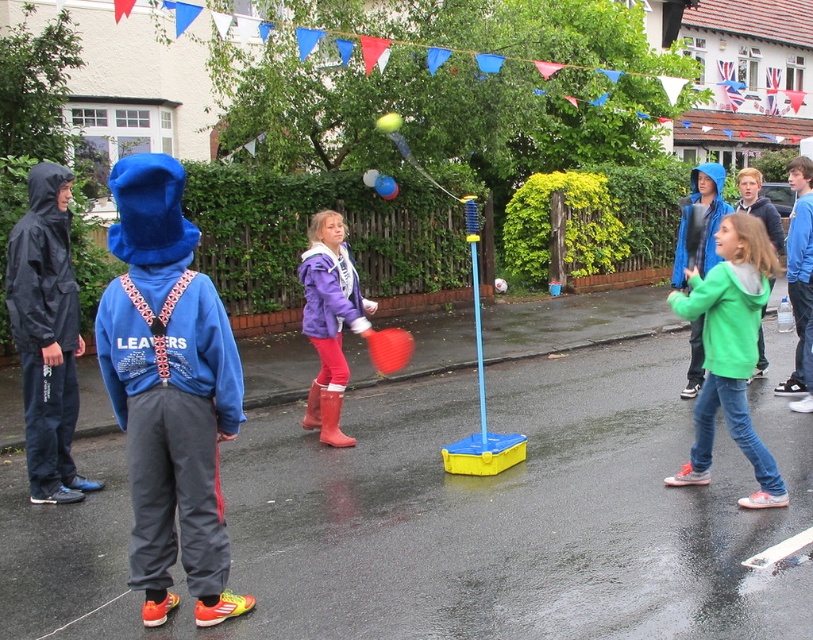
Question: Can you confirm if green fleece jacket at right is smaller than purple fleece jacket at center?

Choices:
 (A) no
 (B) yes

Answer: (A)

Question: From the image, what is the correct spatial relationship of green fleece jacket at right in relation to purple fleece jacket at center?

Choices:
 (A) right
 (B) left

Answer: (A)

Question: Can you confirm if green fleece jacket at right is positioned to the right of purple fleece jacket at center?

Choices:
 (A) yes
 (B) no

Answer: (A)

Question: Which object is farther from the camera taking this photo?

Choices:
 (A) green fleece jacket at right
 (B) purple fleece jacket at center

Answer: (B)

Question: Which of the following is the closest to the observer?

Choices:
 (A) coord(320,300)
 (B) coord(693,294)

Answer: (B)